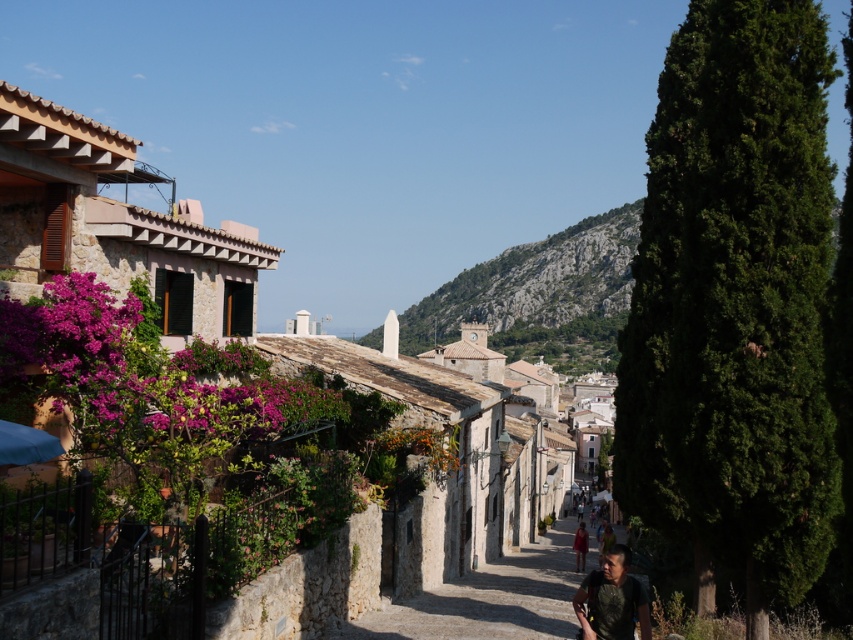
Question: From the image, what is the correct spatial relationship of stone paved path at center in relation to camouflage fabric backpack at lower right?

Choices:
 (A) left
 (B) right

Answer: (B)

Question: Which point appears farthest from the camera in this image?

Choices:
 (A) (669, 468)
 (B) (573, 545)
 (C) (258, 259)
 (D) (612, 621)

Answer: (B)

Question: Is stone paved path at center wider than matte red dress at center?

Choices:
 (A) yes
 (B) no

Answer: (A)

Question: Which point is farther from the camera taking this photo?

Choices:
 (A) (582, 566)
 (B) (689, 429)

Answer: (A)

Question: Observing the image, what is the correct spatial positioning of stone village at center in reference to stone paved path at center?

Choices:
 (A) above
 (B) below

Answer: (A)

Question: Which point is closer to the camera?

Choices:
 (A) camouflage fabric backpack at lower right
 (B) matte red dress at center
 (C) stone paved path at center
 (D) stone village at center

Answer: (D)